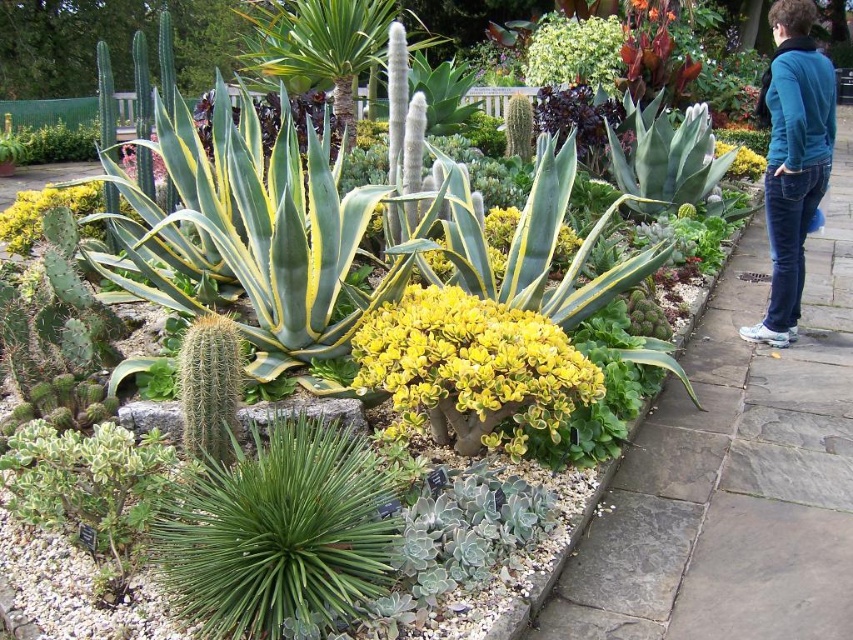
You are standing in the garden and want to take a photo of the two points marked in the scene. Which point, point (732, 577) or point (782, 26), appears closer to you in the image?

Point (732, 577) is closer to the camera than point (782, 26), so it will appear closer to you in the image.